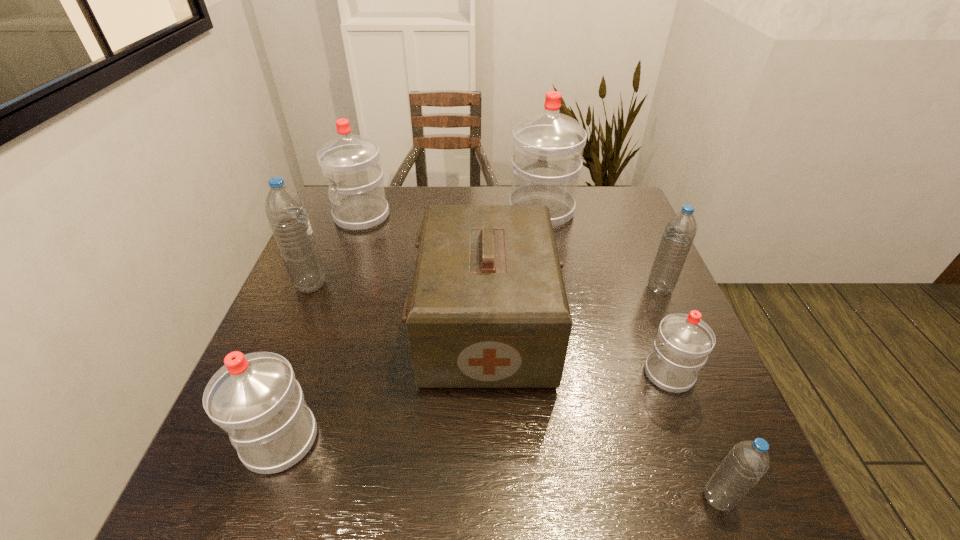
At what (x,y) coordinates should I click in order to perform the action: click on vacant area that lies between the rightmost white water bottle and the smallest blue water bottle. Please return your answer as a coordinate pair (x, y). Looking at the image, I should click on (693, 436).

Where is `free spot between the biggest blue water bottle and the second biggest white water bottle`? The image size is (960, 540). free spot between the biggest blue water bottle and the second biggest white water bottle is located at coordinates coord(336,251).

This screenshot has height=540, width=960. Find the location of `vacant area that lies between the smallest blue water bottle and the second biggest blue water bottle`. vacant area that lies between the smallest blue water bottle and the second biggest blue water bottle is located at coordinates (688, 393).

Find the location of a particular element. This screenshot has width=960, height=540. object that ranks as the fourth closest to the third white water bottle from left to right is located at coordinates tap(683, 342).

Locate an element on the screen. The image size is (960, 540). object that is the closest to the second nearest object is located at coordinates [488, 308].

Locate an element on the screen. water bottle that is the sixth nearest to the fifth farthest water bottle is located at coordinates (351, 163).

Where is `the second closest water bottle relative to the second biggest blue water bottle`? The height and width of the screenshot is (540, 960). the second closest water bottle relative to the second biggest blue water bottle is located at coordinates (548, 146).

This screenshot has height=540, width=960. Find the location of `white water bottle that is the third closest to the smallest blue water bottle`. white water bottle that is the third closest to the smallest blue water bottle is located at coordinates (548, 146).

I want to click on white water bottle that stands as the third closest to the second biggest white water bottle, so click(x=683, y=342).

Identify which blue water bottle is the second nearest to the tallest object. Please provide its 2D coordinates. Your answer should be formatted as a tuple, i.e. [(x, y)], where the tuple contains the x and y coordinates of a point satisfying the conditions above.

[(286, 213)]